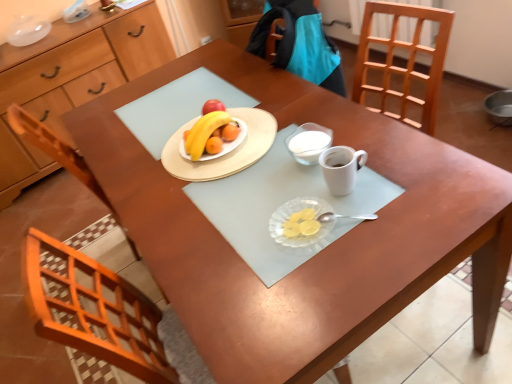
At what (x,y) coordinates should I click in order to perform the action: click on vacant space that's between matte wooden plate at center and transparent glass plate at center. Please return your answer as a coordinate pair (x, y). The image size is (512, 384). Looking at the image, I should click on (268, 188).